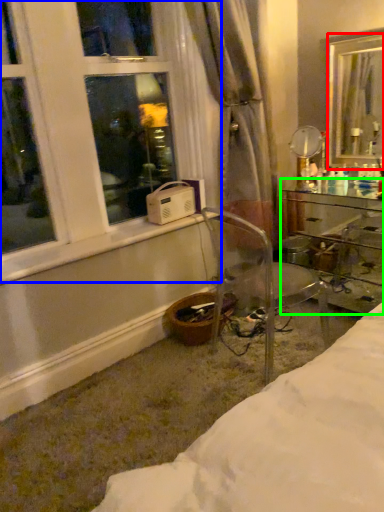
Question: Which object is positioned farthest from mirror (highlighted by a red box)? Select from window (highlighted by a blue box) and desk (highlighted by a green box).

Choices:
 (A) window
 (B) desk

Answer: (A)